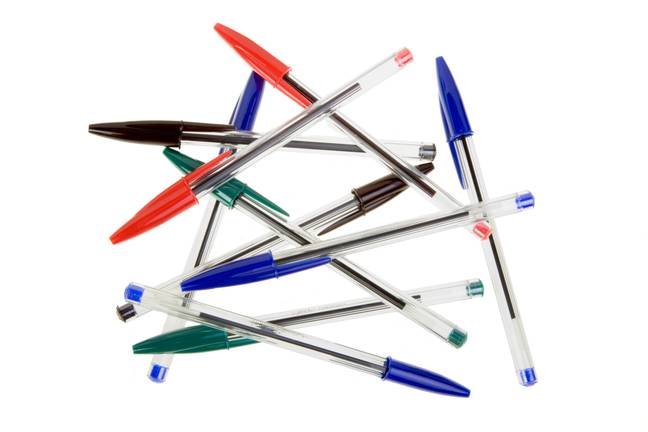
Identify the location of ink inside pens. (297, 341), (330, 310), (373, 235), (326, 213), (321, 141), (269, 141), (209, 236), (380, 150), (503, 278), (354, 272).